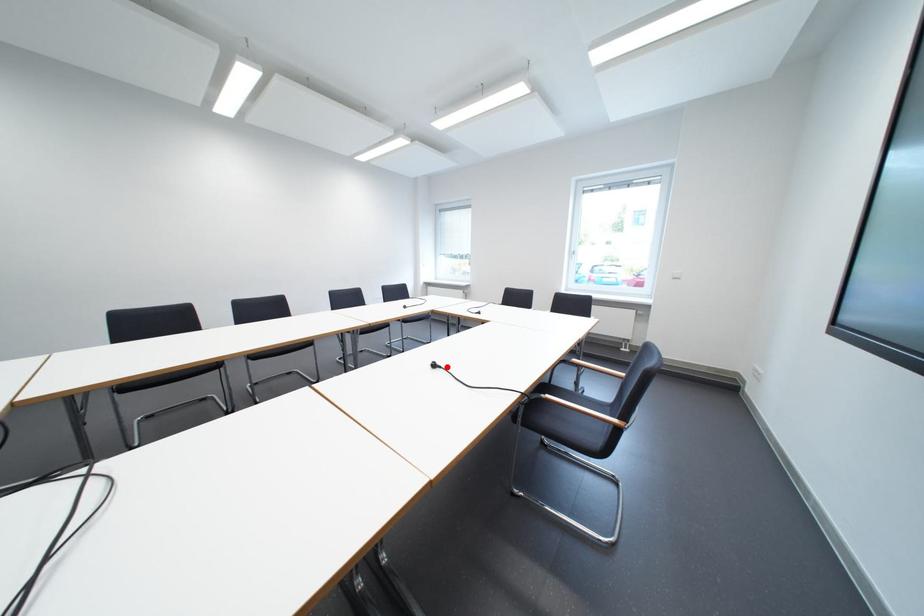
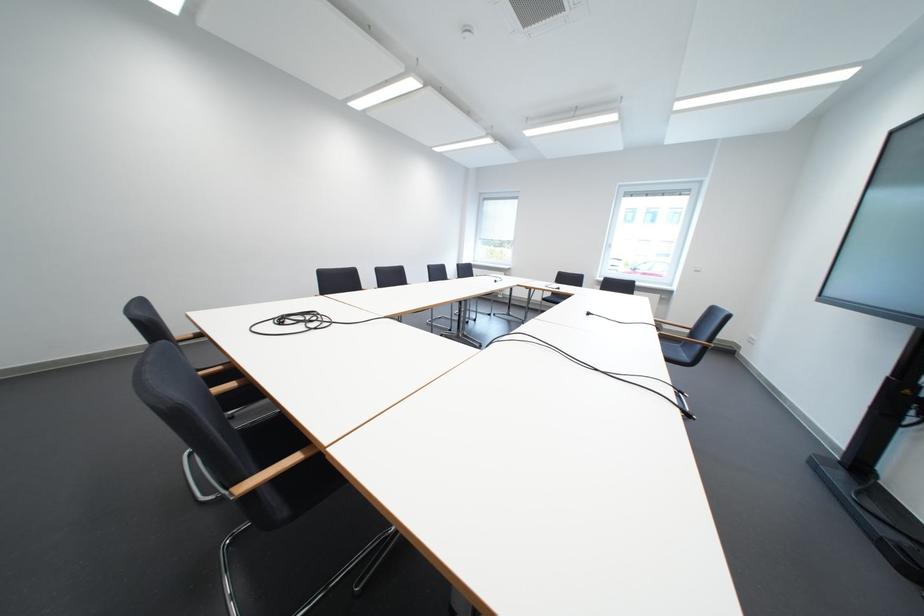
In the second image, find the point that corresponds to the highlighted location in the first image.

(601, 315)